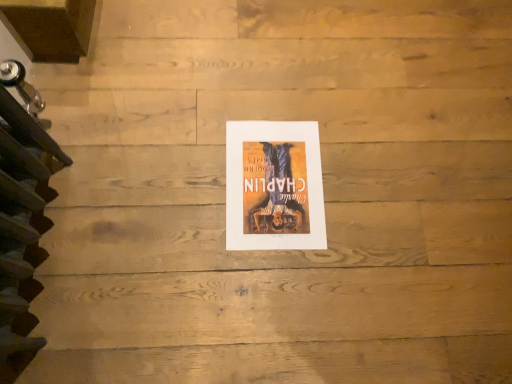
Question: Is matte paper poster at center wider than dark brown wooden stairs at left?

Choices:
 (A) yes
 (B) no

Answer: (A)

Question: Does matte paper poster at center have a larger size compared to dark brown wooden stairs at left?

Choices:
 (A) yes
 (B) no

Answer: (B)

Question: Is there a large distance between matte paper poster at center and dark brown wooden stairs at left?

Choices:
 (A) yes
 (B) no

Answer: (B)

Question: From the image's perspective, is matte paper poster at center on dark brown wooden stairs at left?

Choices:
 (A) yes
 (B) no

Answer: (A)

Question: From the image's perspective, is matte paper poster at center located beneath dark brown wooden stairs at left?

Choices:
 (A) yes
 (B) no

Answer: (B)

Question: Can you confirm if matte paper poster at center is thinner than dark brown wooden stairs at left?

Choices:
 (A) yes
 (B) no

Answer: (B)

Question: Considering the relative positions of dark brown wooden stairs at left and matte paper poster at center in the image provided, is dark brown wooden stairs at left to the right of matte paper poster at center from the viewer's perspective?

Choices:
 (A) no
 (B) yes

Answer: (A)

Question: Is dark brown wooden stairs at left positioned before matte paper poster at center?

Choices:
 (A) no
 (B) yes

Answer: (B)

Question: Is dark brown wooden stairs at left not inside matte paper poster at center?

Choices:
 (A) no
 (B) yes

Answer: (B)

Question: Is dark brown wooden stairs at left far from matte paper poster at center?

Choices:
 (A) yes
 (B) no

Answer: (B)

Question: Considering the relative sizes of dark brown wooden stairs at left and matte paper poster at center in the image provided, is dark brown wooden stairs at left smaller than matte paper poster at center?

Choices:
 (A) yes
 (B) no

Answer: (B)

Question: Is the position of dark brown wooden stairs at left more distant than that of matte paper poster at center?

Choices:
 (A) no
 (B) yes

Answer: (A)

Question: Is matte paper poster at center wider or thinner than dark brown wooden stairs at left?

Choices:
 (A) wide
 (B) thin

Answer: (A)